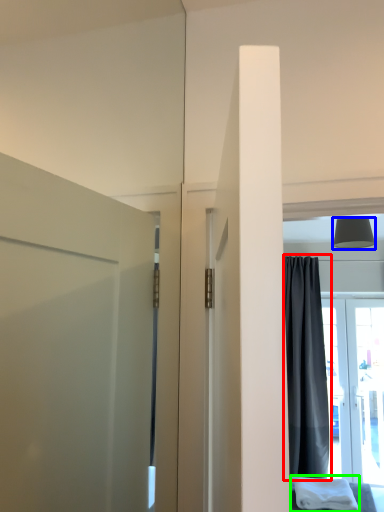
Question: Which object is the closest to the curtain (highlighted by a red box)? Choose among these: lamp (highlighted by a blue box) or cloth (highlighted by a green box).

Choices:
 (A) lamp
 (B) cloth

Answer: (B)